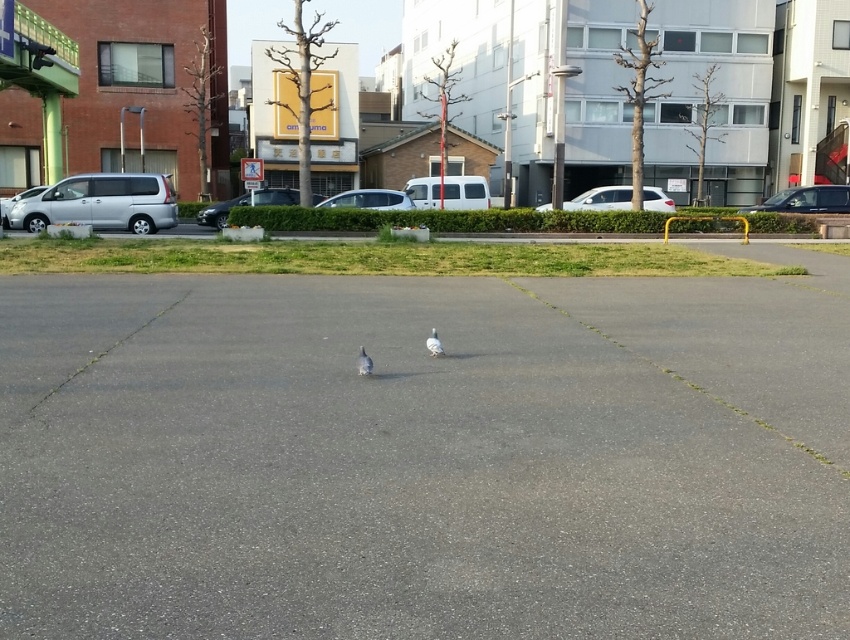
You are standing at the point labeled as point (601, 198) in the image. What object is located exactly at this point?

The point (601, 198) indicates a white matte car at center.

You are standing at the pedestrian crossing sign near the center of the image. You want to walk straight ahead towards the buildings in the background. Will the white matte car at center block your path?

The white matte car at center is located at point (601, 198), which is directly in front of the pedestrian crossing sign. Therefore, the white matte car at center will block your path if you walk straight ahead towards the buildings in the background.

You are a pedestrian standing at the pedestrian crossing sign near the center. You see a white matte car at center and a silver metallic car at center. Which car is positioned more to your right side?

The white matte car at center is to the right of the silver metallic car at center, so the white matte car at center is positioned more to your right side.